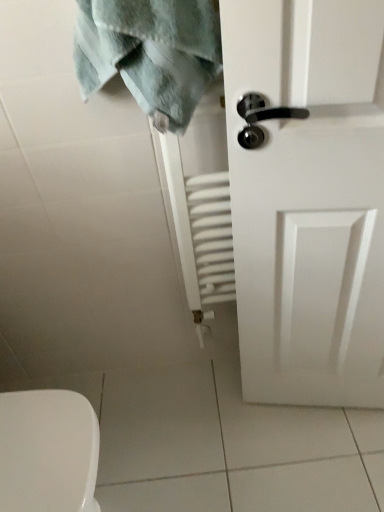
Question: Is white matte door at right closer to camera compared to green textured towel at upper left?

Choices:
 (A) no
 (B) yes

Answer: (B)

Question: From the image's perspective, is white matte door at right on green textured towel at upper left?

Choices:
 (A) no
 (B) yes

Answer: (A)

Question: Considering the relative sizes of white matte door at right and green textured towel at upper left in the image provided, is white matte door at right bigger than green textured towel at upper left?

Choices:
 (A) no
 (B) yes

Answer: (B)

Question: Considering the relative sizes of white matte door at right and green textured towel at upper left in the image provided, is white matte door at right shorter than green textured towel at upper left?

Choices:
 (A) no
 (B) yes

Answer: (A)

Question: Can you confirm if white matte door at right is positioned to the left of green textured towel at upper left?

Choices:
 (A) no
 (B) yes

Answer: (A)

Question: Is white matte door at right far away from green textured towel at upper left?

Choices:
 (A) no
 (B) yes

Answer: (A)

Question: Can you confirm if green textured towel at upper left is smaller than white matte door at right?

Choices:
 (A) yes
 (B) no

Answer: (A)

Question: From the image's perspective, does green textured towel at upper left appear lower than white matte door at right?

Choices:
 (A) no
 (B) yes

Answer: (A)

Question: Would you consider green textured towel at upper left to be distant from white matte door at right?

Choices:
 (A) no
 (B) yes

Answer: (A)

Question: Is green textured towel at upper left directly adjacent to white matte door at right?

Choices:
 (A) no
 (B) yes

Answer: (A)

Question: Is green textured towel at upper left at the left side of white matte door at right?

Choices:
 (A) yes
 (B) no

Answer: (A)

Question: Considering the relative sizes of green textured towel at upper left and white matte door at right in the image provided, is green textured towel at upper left thinner than white matte door at right?

Choices:
 (A) no
 (B) yes

Answer: (A)

Question: Considering the relative positions of green textured towel at upper left and white matte door at right in the image provided, is green textured towel at upper left to the left or to the right of white matte door at right?

Choices:
 (A) right
 (B) left

Answer: (B)